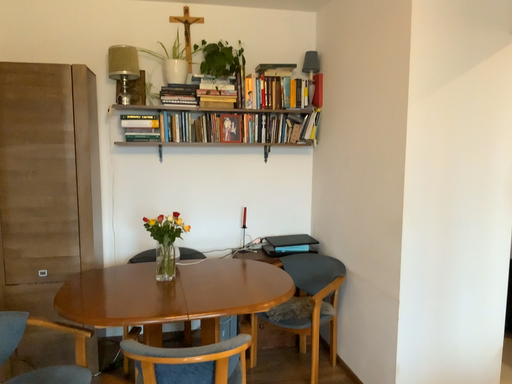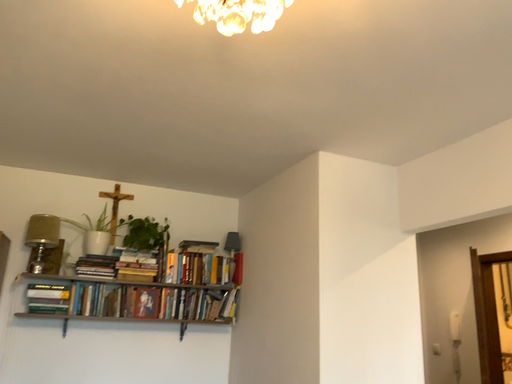
Question: How did the camera likely rotate when shooting the video?

Choices:
 (A) rotated right
 (B) rotated left

Answer: (A)